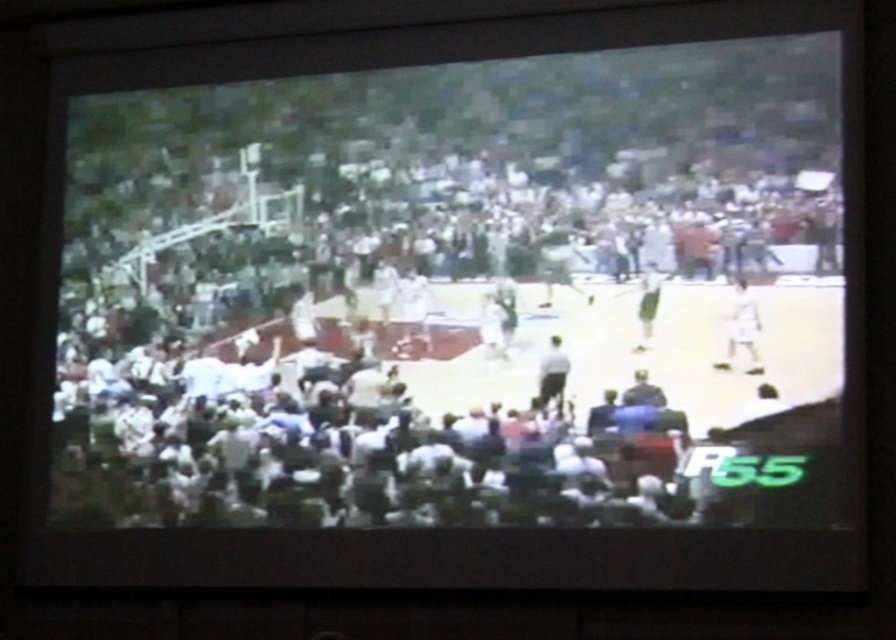
Question: Is white jersey basketball team at center to the right of light gray fabric person at center from the viewer's perspective?

Choices:
 (A) no
 (B) yes

Answer: (A)

Question: Which point is farther from the camera taking this photo?

Choices:
 (A) (757, 332)
 (B) (649, 268)

Answer: (B)

Question: Considering the real-world distances, which object is closest to the white fabric person at center?

Choices:
 (A) light gray fabric person at center
 (B) white jersey basketball team at center

Answer: (A)

Question: Which of the following is the farthest from the observer?

Choices:
 (A) (737, 294)
 (B) (652, 282)

Answer: (B)

Question: Is light gray fabric person at center positioned before white fabric person at center?

Choices:
 (A) yes
 (B) no

Answer: (B)

Question: Does white matte basketball player at right come behind light gray fabric person at center?

Choices:
 (A) yes
 (B) no

Answer: (B)